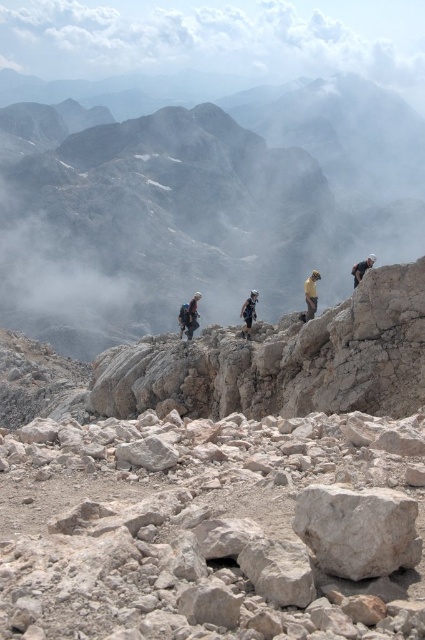
What do you see at coordinates (357, 529) in the screenshot? The image size is (425, 640). I see `white rough rock at center` at bounding box center [357, 529].

Is white rough rock at center below gray rough rock at center?

No, white rough rock at center is not below gray rough rock at center.

Describe the element at coordinates (357, 529) in the screenshot. I see `white rough rock at center` at that location.

What are the coordinates of `white rough rock at center` in the screenshot? It's located at (357, 529).

Does rocky cliff at center have a smaller size compared to white fluffy cloud at upper center?

No.

This screenshot has width=425, height=640. I want to click on rocky cliff at center, so click(200, 205).

Can you confirm if white fluffy cloud at upper center is positioned below gray rough rock at center?

No.

The height and width of the screenshot is (640, 425). What do you see at coordinates (217, 36) in the screenshot?
I see `white fluffy cloud at upper center` at bounding box center [217, 36].

Is point (172, 19) positioned before point (263, 554)?

No, it is not.

Locate an element on the screen. This screenshot has width=425, height=640. white fluffy cloud at upper center is located at coordinates (217, 36).